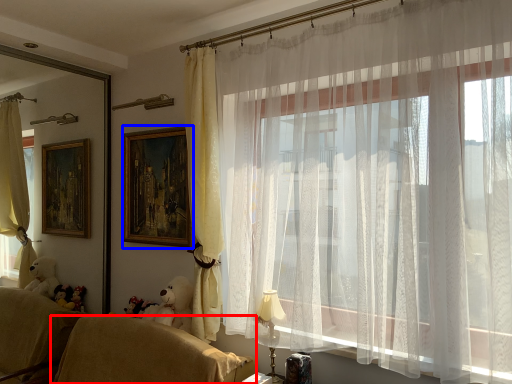
Question: Which point is further to the camera, furniture (highlighted by a red box) or picture frame (highlighted by a blue box)?

Choices:
 (A) furniture
 (B) picture frame

Answer: (B)